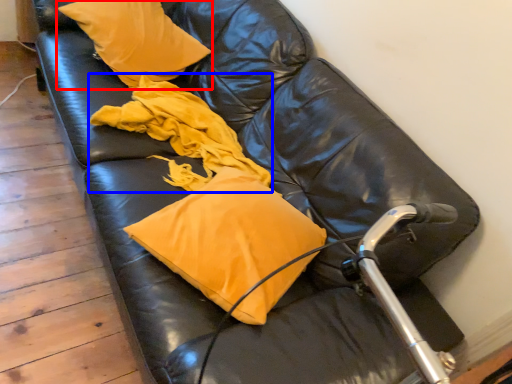
Question: Among these objects, which one is nearest to the camera, pillow (highlighted by a red box) or material (highlighted by a blue box)?

Choices:
 (A) pillow
 (B) material

Answer: (B)